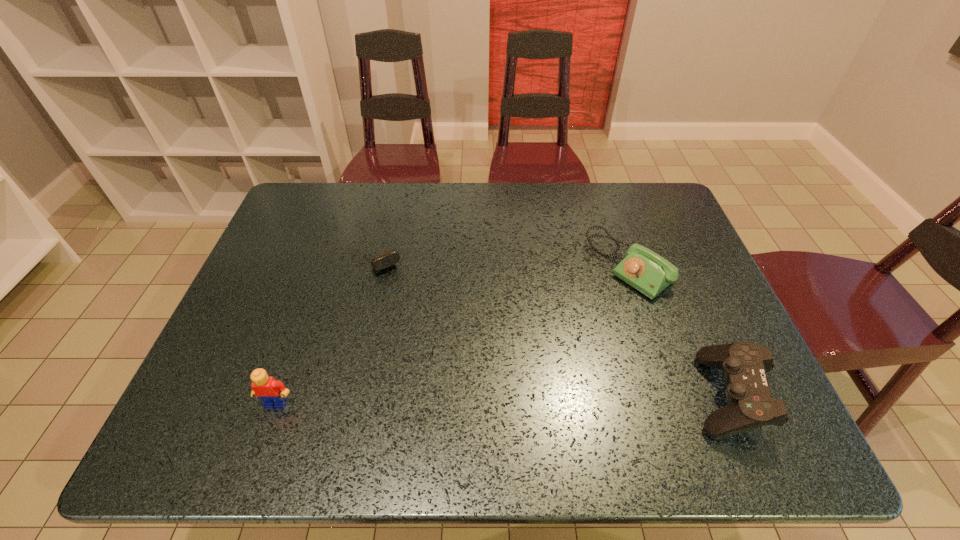
Find the location of a particular element. The width and height of the screenshot is (960, 540). vacant point located between the telephone and the control is located at coordinates (678, 330).

This screenshot has height=540, width=960. Identify the location of vacant region between the tallest object and the telephone. (452, 334).

In order to click on vacant point located between the third tallest object and the control in this screenshot , I will do `click(678, 330)`.

Identify the location of vacant area between the webcam and the leftmost object. (326, 326).

Where is `vacant area that lies between the Lego and the webcam`? The height and width of the screenshot is (540, 960). vacant area that lies between the Lego and the webcam is located at coordinates (326, 326).

This screenshot has height=540, width=960. Identify the location of free space between the shortest object and the second shortest object. (502, 258).

Image resolution: width=960 pixels, height=540 pixels. I want to click on vacant area that lies between the control and the webcam, so click(551, 322).

Where is `object that is the second closest one to the leftmost object`? The image size is (960, 540). object that is the second closest one to the leftmost object is located at coordinates (643, 269).

Point out which object is positioned as the third nearest to the Lego. Please provide its 2D coordinates. Your answer should be formatted as a tuple, i.e. [(x, y)], where the tuple contains the x and y coordinates of a point satisfying the conditions above.

[(744, 364)]

Identify the location of free spot that satisfies the following two spatial constraints: 1. on the front side of the telephone; 2. on the right side of the third shortest object. Image resolution: width=960 pixels, height=540 pixels. (671, 394).